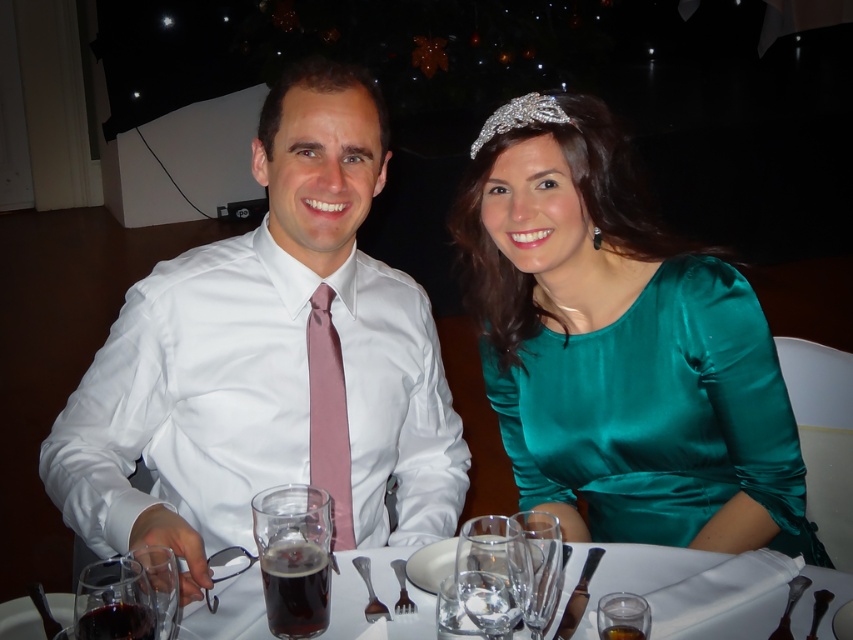
Question: Which object is closer to the camera taking this photo?

Choices:
 (A) transparent glass wine at lower left
 (B) amber liquid glass at lower center

Answer: (A)

Question: Is the position of polished silver spoon at lower center more distant than that of silvermetallicfork at right?

Choices:
 (A) no
 (B) yes

Answer: (A)

Question: Does transparent glass wine at lower left appear on the left side of polished metal spoon at lower right?

Choices:
 (A) yes
 (B) no

Answer: (A)

Question: Is clear glass wine glass at center further to camera compared to dark liquid glass at lower left?

Choices:
 (A) no
 (B) yes

Answer: (B)

Question: Based on their relative distances, which object is nearer to the shiny metal fork at lower center?

Choices:
 (A) transparent glass wine at lower left
 (B) silvermetallicfork at right

Answer: (B)

Question: Which of these objects is positioned farthest from the transparent glass wine at lower left?

Choices:
 (A) dark liquid glass at lower left
 (B) transparent glass at lower center
 (C) polished metal spoon at lower right
 (D) shiny metal fork at lower center

Answer: (D)